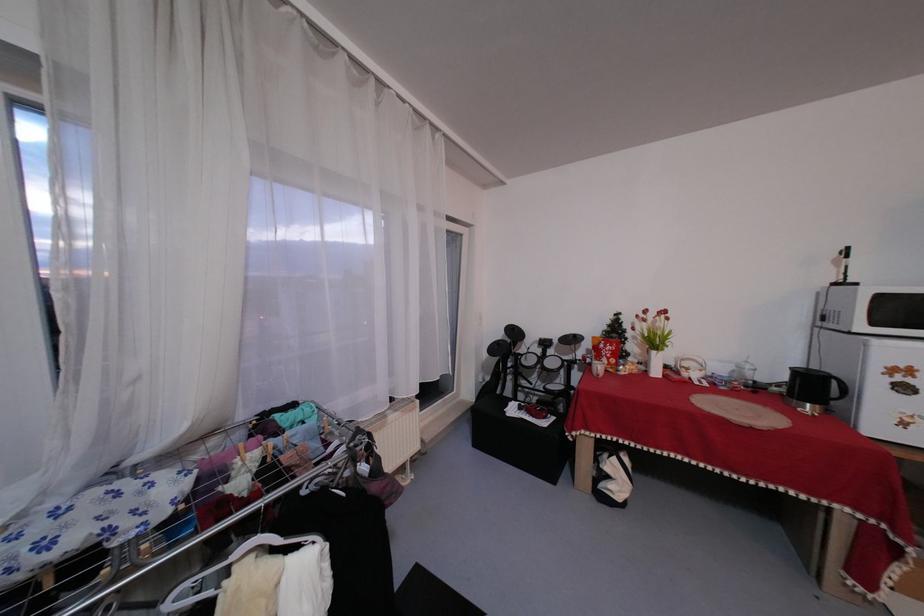
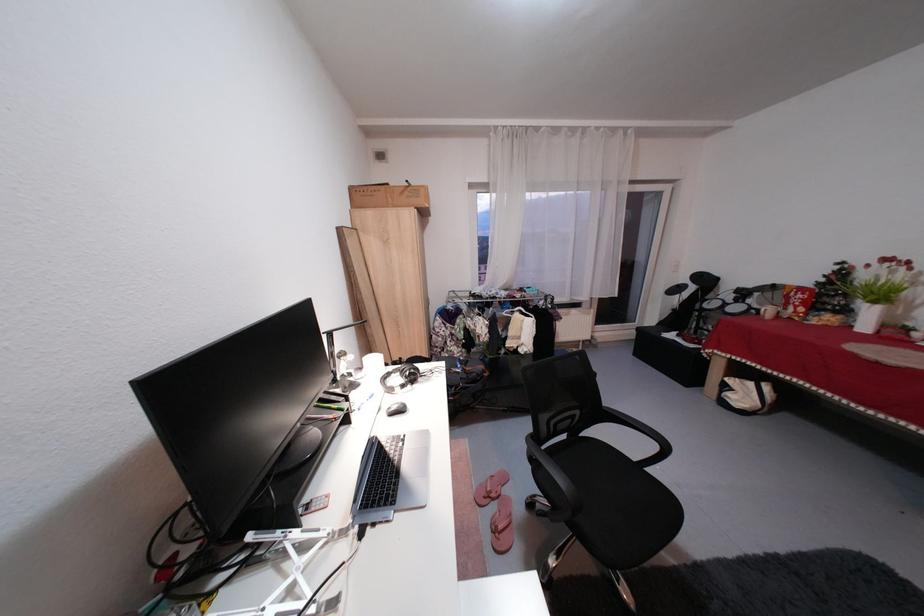
In the second image, find the point that corresponds to [667,374] in the first image.

(877, 330)